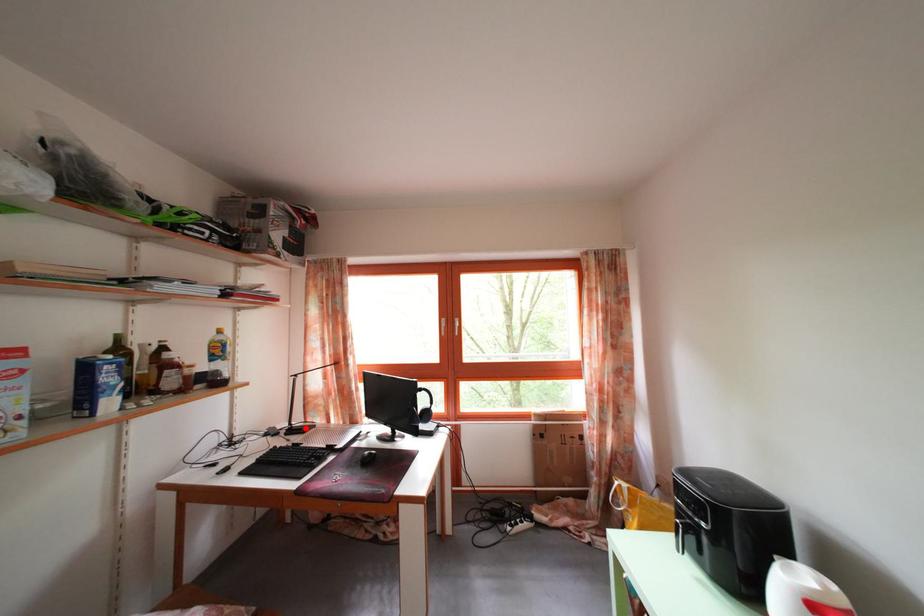
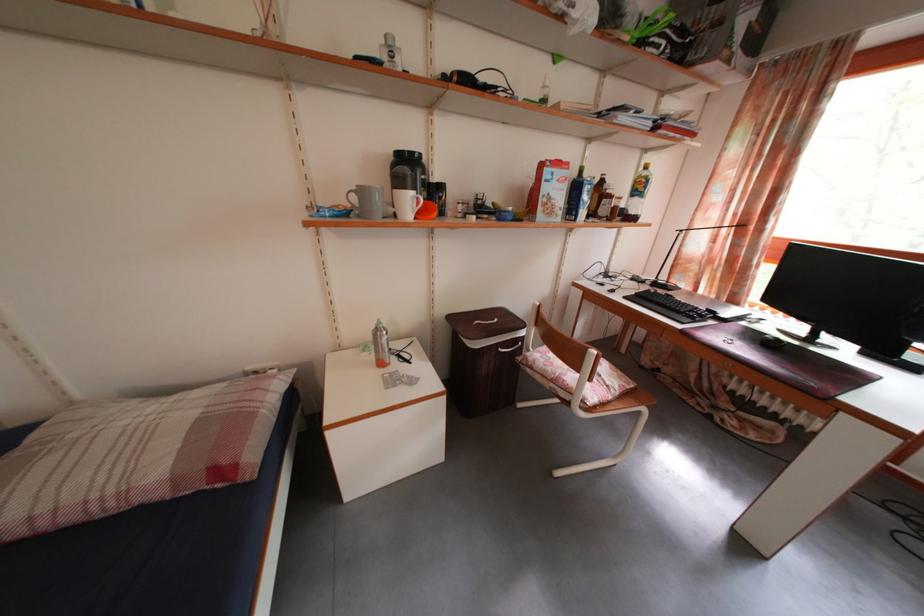
Locate, in the second image, the point that corresponds to the highlighted location in the first image.

(671, 285)